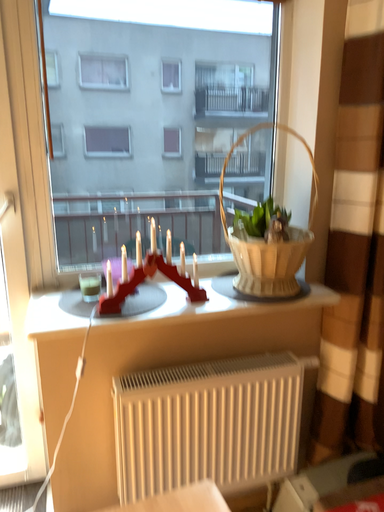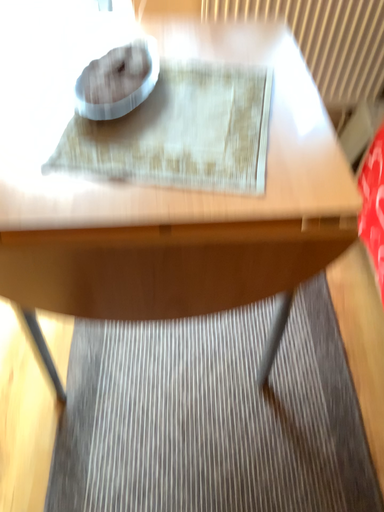
Question: How did the camera likely rotate when shooting the video?

Choices:
 (A) rotated upward
 (B) rotated downward

Answer: (B)